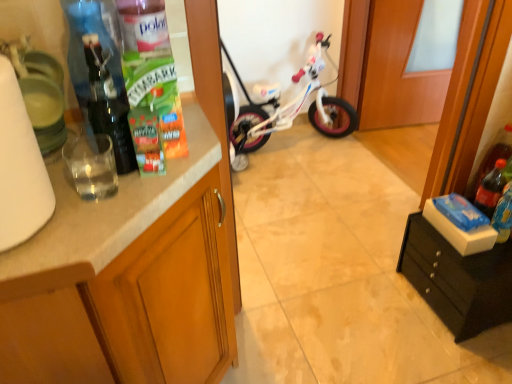
Find the location of a particular element. The image size is (512, 384). blank area to the left of black matte drawer at lower right, positioned as the second cabinetry in left-to-right order is located at coordinates (396, 334).